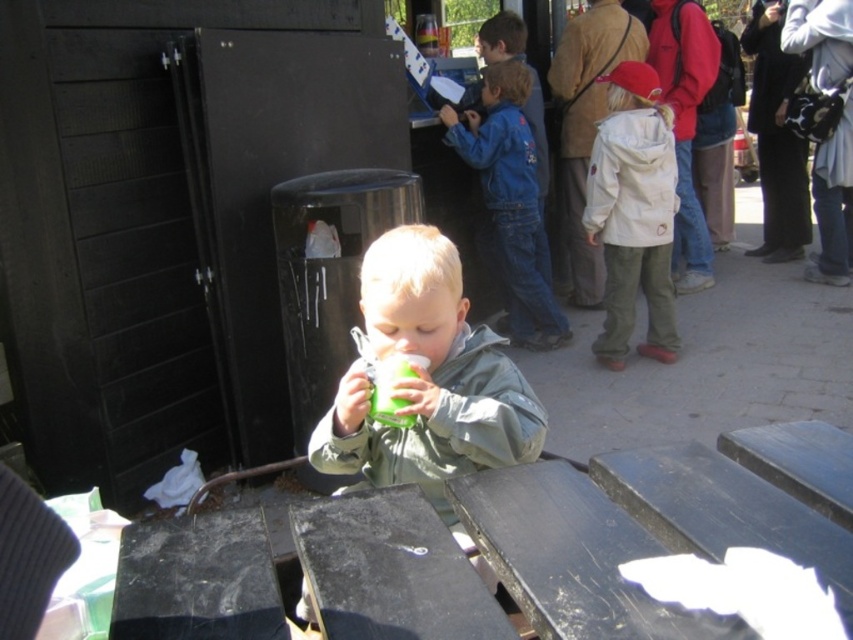
Question: Which point appears closest to the camera in this image?

Choices:
 (A) (445, 134)
 (B) (444, 301)
 (C) (663, 132)

Answer: (B)

Question: Which point appears closest to the camera in this image?

Choices:
 (A) (412, 404)
 (B) (621, 310)
 (C) (502, 100)

Answer: (A)

Question: Considering the relative positions of white matte jacket at right and blue denim jacket at center in the image provided, where is white matte jacket at right located with respect to blue denim jacket at center?

Choices:
 (A) below
 (B) above

Answer: (A)

Question: Can you confirm if green matte cup at center is positioned to the right of blue denim jacket at center?

Choices:
 (A) no
 (B) yes

Answer: (A)

Question: Among these objects, which one is farthest from the camera?

Choices:
 (A) blue denim jacket at center
 (B) green matte cup at center
 (C) white matte jacket at right

Answer: (A)

Question: Is green matte cup at center wider than white matte jacket at right?

Choices:
 (A) yes
 (B) no

Answer: (B)